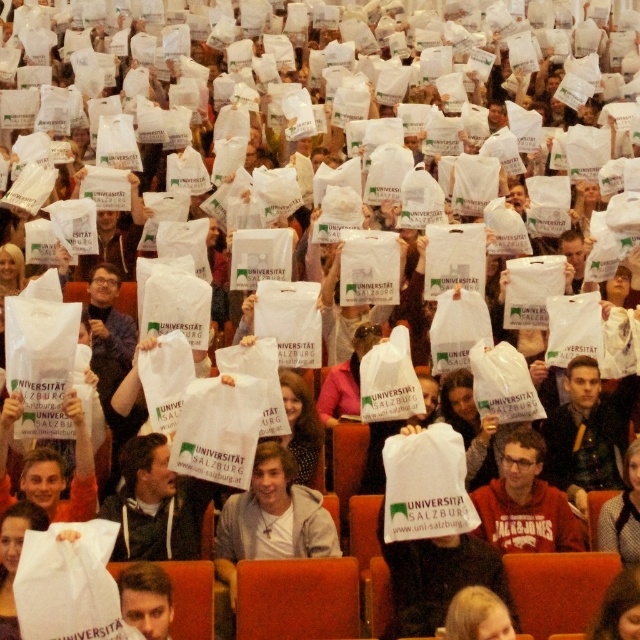
You are sitting in the front row of the auditorium and want to hand a note to the person with the smooth white shirt at lower left and the person with blonde hair at center. Which person should you approach first based on their seating positions?

You should approach the person with the smooth white shirt at lower left first because they are closer to you than the person with blonde hair at center.

You are a photographer standing at the back of the auditorium. You want to take a closeup photo of the white cotton shirt at center. Considering the distance, is it possible to capture a clear image without using a zoom lens?

The white cotton shirt at center is 24.47 meters away from the camera. Without a zoom lens, capturing a clear closeup at this distance would be challenging due to the limited focal length of standard lenses, so it might not be possible.

You are an event organizer trying to arrange a photo shoot in the auditorium. You need to place a 10 cm wide decorative ribbon between the smooth white shirt at lower left and the blonde hair at center. Will the ribbon fit between them?

The smooth white shirt at lower left is thinner than the blonde hair at center, so the space between them is at least 10 cm. Therefore, the ribbon will fit between them.